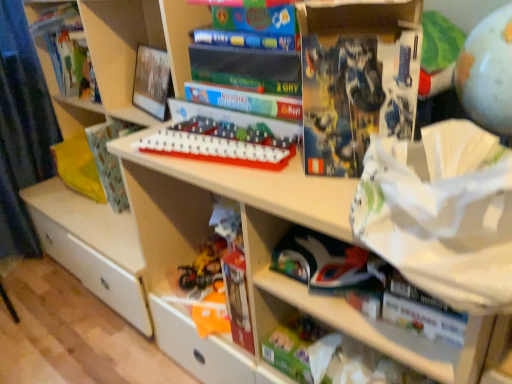
Question: Choose the correct answer: Is blue matte book at upper center, which appears as the second paperback book when viewed from the back, inside shiny plastic toys at lower center, the third toy viewed from the top, or outside it?

Choices:
 (A) outside
 (B) inside

Answer: (A)

Question: From their relative heights in the image, would you say blue matte book at upper center, which appears as the second paperback book when viewed from the back, is taller or shorter than shiny plastic toys at lower center, the third toy viewed from the top?

Choices:
 (A) tall
 (B) short

Answer: (A)

Question: Which is nearer to the patterned paper at left, the 1th paperback book positioned from the left?

Choices:
 (A) green matte toy at lower center, placed as the 3th toy when sorted from front to back
 (B) blue matte book at upper center, the 2th paperback book when ordered from left to right
 (C) white plastic game board at center, the third toy when ordered from bottom to top
 (D) matte gray globe at upper right, marked as the fourth toy in a left-to-right arrangement
 (E) shiny plastic toys at lower center, the 4th toy viewed from the right

Answer: (E)

Question: Based on their relative distances, which object is farther from the patterned paper at left, the 1th paperback book positioned from the left?

Choices:
 (A) shiny plastic toys at lower center, the first toy in the back-to-front sequence
 (B) blue matte book at upper center, which appears as the second paperback book when viewed from the back
 (C) green matte toy at lower center, the second toy viewed from the right
 (D) white plastic game board at center, the third toy when ordered from bottom to top
 (E) hardcover book at upper left

Answer: (B)